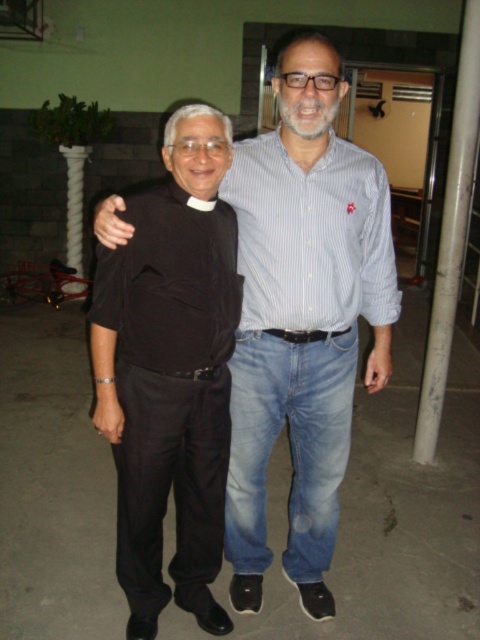
Question: Which object is farther from the camera taking this photo?

Choices:
 (A) blue striped shirt at center
 (B) black matte shirt at center

Answer: (A)

Question: Observing the image, what is the correct spatial positioning of black matte shirt at center in reference to blue striped shirt at center?

Choices:
 (A) below
 (B) above

Answer: (A)

Question: Does black matte shirt at center appear on the left side of blue striped shirt at center?

Choices:
 (A) yes
 (B) no

Answer: (A)

Question: Is black matte shirt at center bigger than blue striped shirt at center?

Choices:
 (A) no
 (B) yes

Answer: (B)

Question: Which object appears farthest from the camera in this image?

Choices:
 (A) black matte shirt at center
 (B) blue striped shirt at center

Answer: (B)